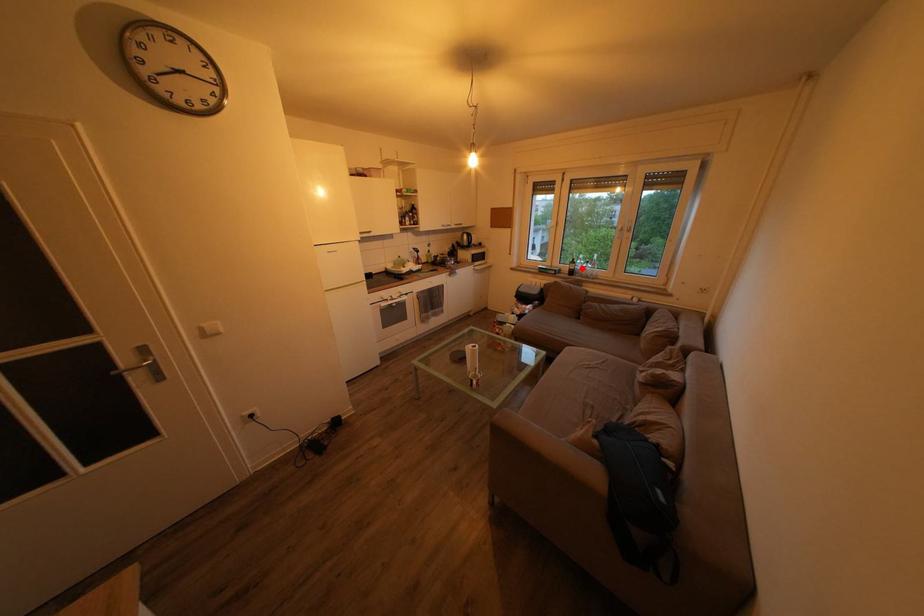
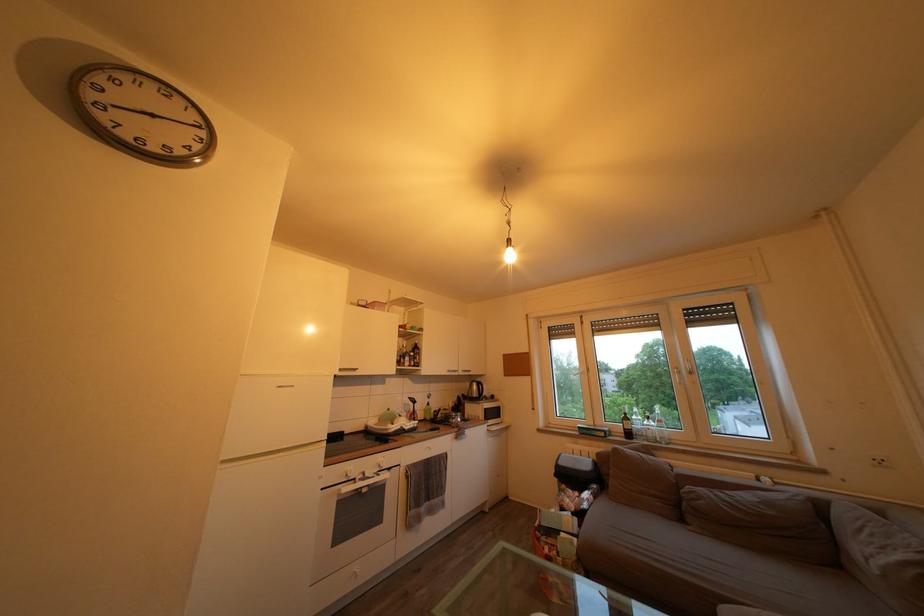
Question: A red point is marked in image1. In image2, is the corresponding 3D point closer to the camera or farther? Reply with the corresponding letter.

Choices:
 (A) The corresponding 3D point is closer.
 (B) The corresponding 3D point is farther.

Answer: (B)